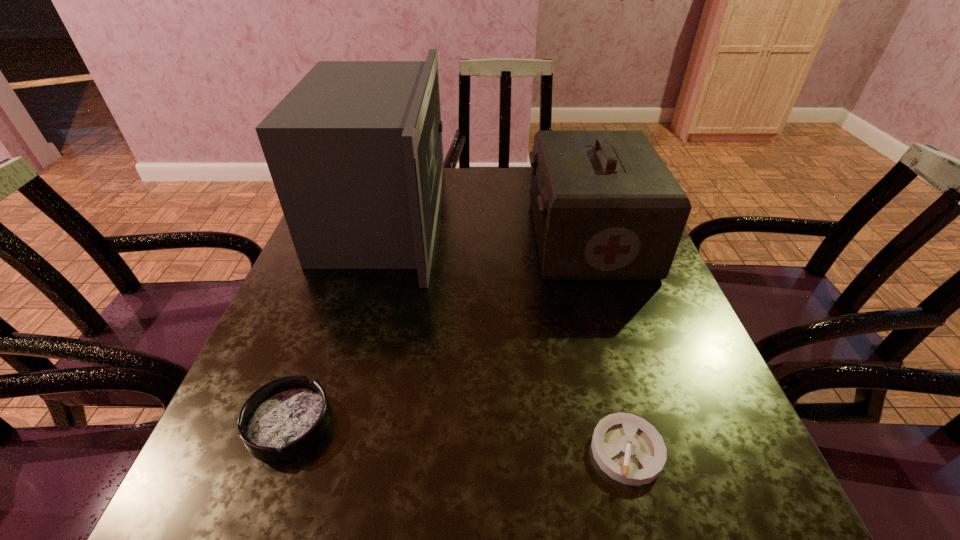
What are the coordinates of `vacant region that satisfies the following two spatial constraints: 1. on the front-facing side of the microwave oven; 2. on the right side of the second tallest object` in the screenshot? It's located at (377, 238).

At what (x,y) coordinates should I click in order to perform the action: click on vacant region that satisfies the following two spatial constraints: 1. on the front-facing side of the tallest object; 2. on the right side of the first-aid kit. Please return your answer as a coordinate pair (x, y). The width and height of the screenshot is (960, 540). Looking at the image, I should click on (377, 238).

You are a GUI agent. You are given a task and a screenshot of the screen. Output one action in this format:
    pyautogui.click(x=<x>, y=<y>)
    Task: Click on the free spot that satisfies the following two spatial constraints: 1. on the back side of the second tallest object; 2. on the right side of the second shortest object
    This screenshot has width=960, height=540.
    Given the screenshot: What is the action you would take?
    pyautogui.click(x=356, y=238)

You are a GUI agent. You are given a task and a screenshot of the screen. Output one action in this format:
    pyautogui.click(x=<x>, y=<y>)
    Task: Click on the free point that satisfies the following two spatial constraints: 1. on the front-facing side of the microwave oven; 2. on the right side of the shortest object
    The height and width of the screenshot is (540, 960).
    Given the screenshot: What is the action you would take?
    pyautogui.click(x=314, y=450)